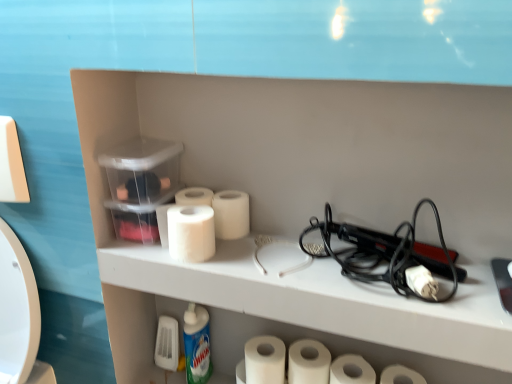
What are the coordinates of `vacant region below black plastic hair straightener at right (from a real-world perspective)` in the screenshot? It's located at (354, 269).